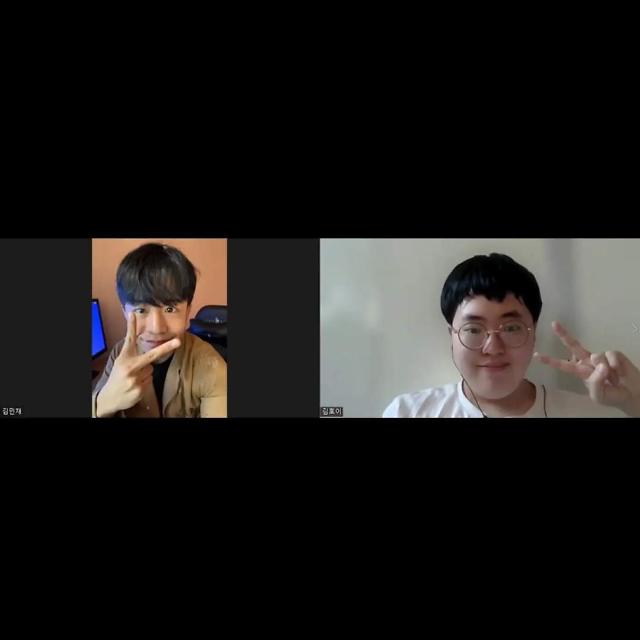
In order to click on chair in this screenshot , I will do `click(219, 319)`.